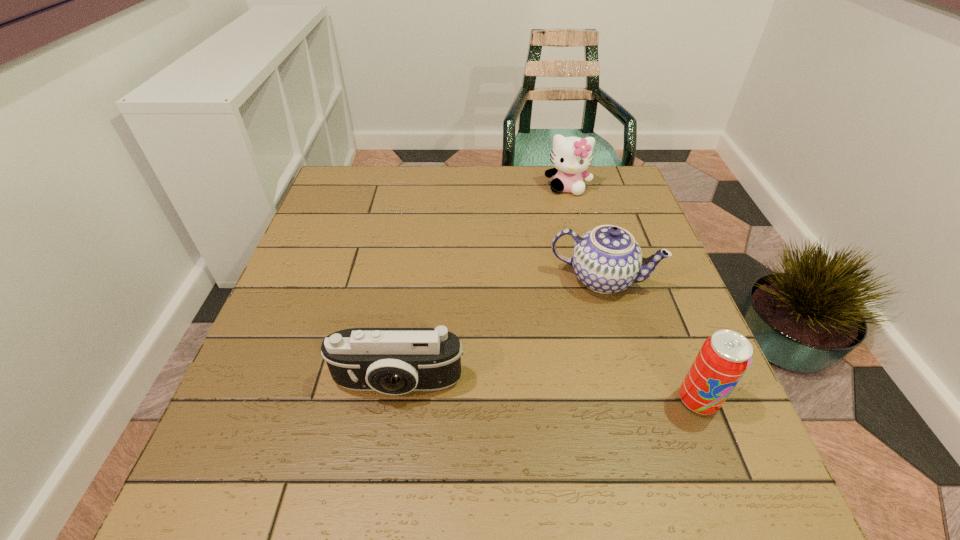
This screenshot has height=540, width=960. Find the location of `free space in the image that satisfies the following two spatial constraints: 1. on the front lens of the soda can; 2. on the left side of the camera`. free space in the image that satisfies the following two spatial constraints: 1. on the front lens of the soda can; 2. on the left side of the camera is located at coordinates (396, 400).

Find the location of a particular element. This screenshot has height=540, width=960. free location that satisfies the following two spatial constraints: 1. on the front lens of the camera; 2. on the left side of the soda can is located at coordinates (396, 400).

Image resolution: width=960 pixels, height=540 pixels. Find the location of `free point that satisfies the following two spatial constraints: 1. on the front side of the soda can; 2. on the left side of the chinaware`. free point that satisfies the following two spatial constraints: 1. on the front side of the soda can; 2. on the left side of the chinaware is located at coordinates (636, 400).